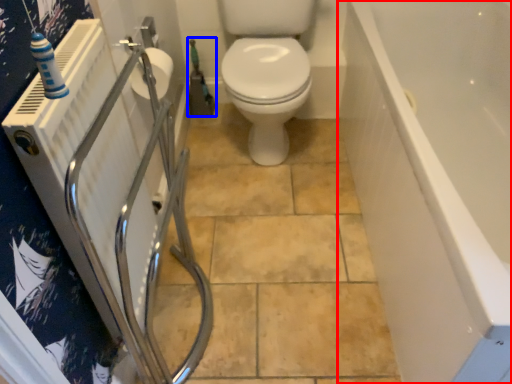
Question: Which object appears farthest to the camera in this image, bath (highlighted by a red box) or garden hose (highlighted by a blue box)?

Choices:
 (A) bath
 (B) garden hose

Answer: (B)